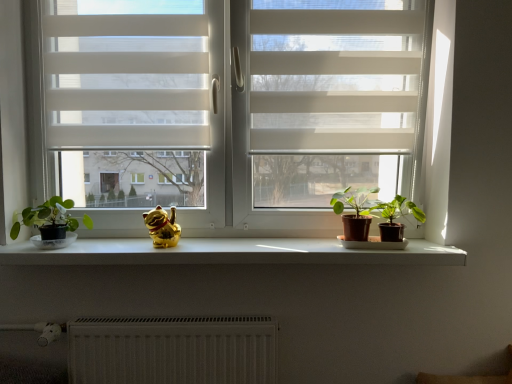
Identify the location of vacant space that's between gold shiny cat at center and green matte houseplant at right, acting as the 1th houseplant starting from the right. This screenshot has width=512, height=384. (264, 246).